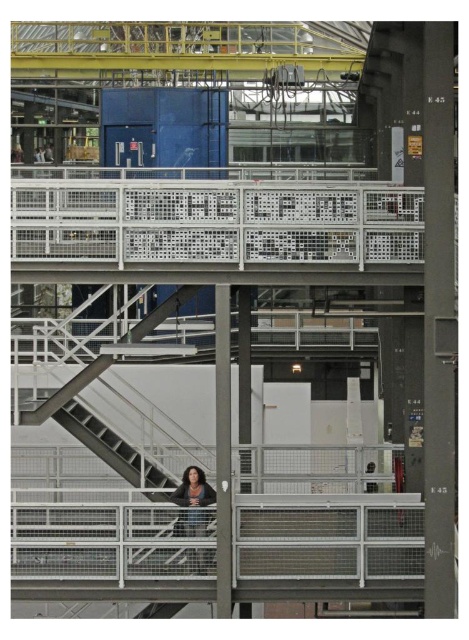
Question: Which point is farther to the camera?

Choices:
 (A) (195, 561)
 (B) (370, 484)

Answer: (B)

Question: Which object is farther from the camera taking this photo?

Choices:
 (A) dark brown leather jacket at center
 (B) dark brown leather jacket at lower center

Answer: (B)

Question: From the image, what is the correct spatial relationship of dark brown leather jacket at center in relation to dark brown leather jacket at lower center?

Choices:
 (A) right
 (B) left

Answer: (B)

Question: Can you confirm if dark brown leather jacket at center is positioned above dark brown leather jacket at lower center?

Choices:
 (A) no
 (B) yes

Answer: (A)

Question: Can you confirm if dark brown leather jacket at center is positioned to the right of dark brown leather jacket at lower center?

Choices:
 (A) yes
 (B) no

Answer: (B)